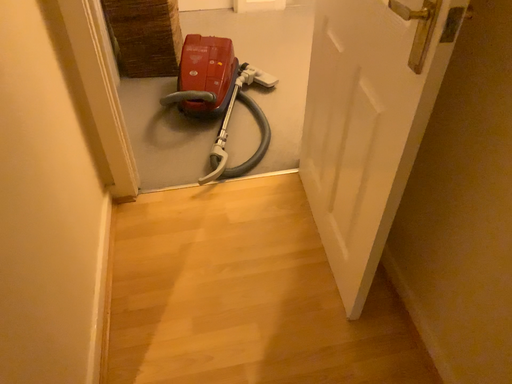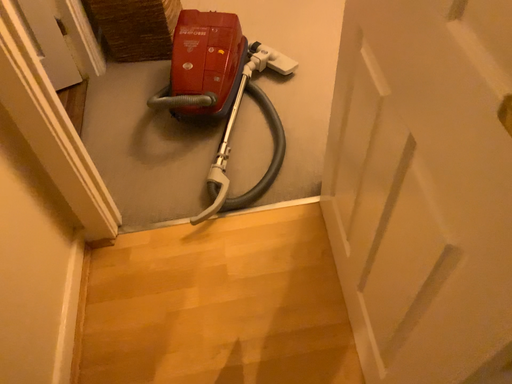
Question: How did the camera likely rotate when shooting the video?

Choices:
 (A) rotated upward
 (B) rotated downward

Answer: (B)